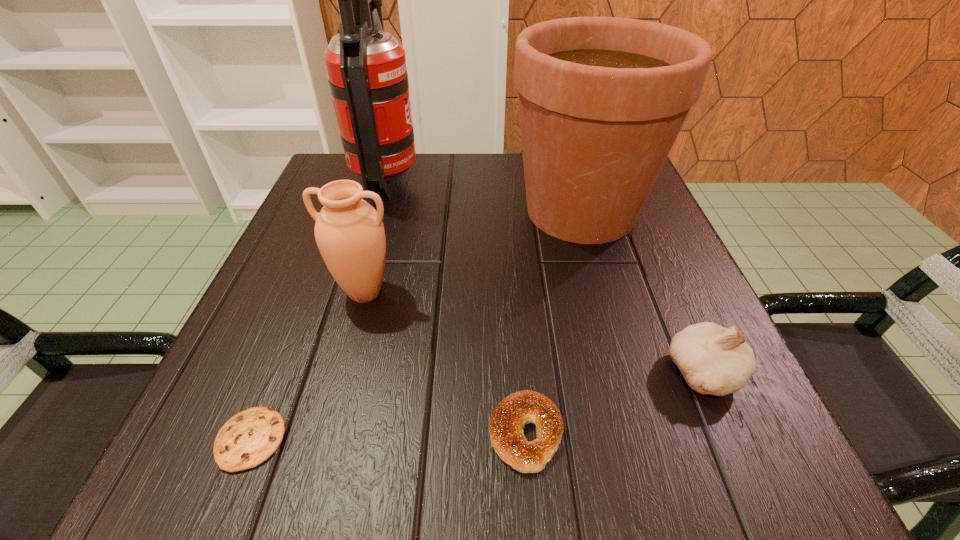
Find the location of a particular element. This screenshot has height=540, width=960. flowerpot that is positioned at the right edge is located at coordinates (602, 100).

Find the location of `garlic located at the right edge`. garlic located at the right edge is located at coordinates (715, 360).

This screenshot has width=960, height=540. I want to click on object that is at the far left corner, so click(366, 67).

Identify the location of object located in the near left corner section of the desktop. (250, 437).

You are a GUI agent. You are given a task and a screenshot of the screen. Output one action in this format:
    pyautogui.click(x=<x>, y=<y>)
    Task: Click on the object present at the far right corner
    
    Given the screenshot: What is the action you would take?
    pyautogui.click(x=602, y=100)

Identify the location of vacant area at the far edge of the desktop. This screenshot has height=540, width=960. (442, 174).

This screenshot has height=540, width=960. Find the location of `vacant space at the near edge of the desktop`. vacant space at the near edge of the desktop is located at coordinates (563, 442).

In the image, there is a desktop. What are the coordinates of `vacant space at the left edge` in the screenshot? It's located at (278, 320).

This screenshot has height=540, width=960. In the image, there is a desktop. What are the coordinates of `vacant space at the right edge` in the screenshot? It's located at (625, 258).

Locate an element on the screen. The image size is (960, 540). free space at the far left corner of the desktop is located at coordinates (321, 186).